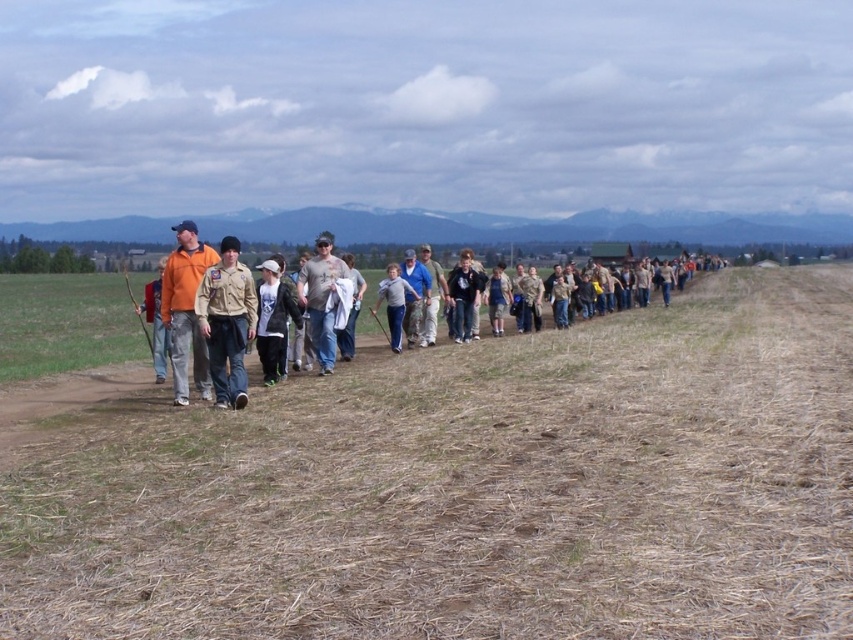
Question: Which is farther from the matte gray t-shirt at center?

Choices:
 (A) white matte shirt at center
 (B) gray cotton shirt at center

Answer: (B)

Question: Estimate the real-world distances between objects in this image. Which object is farther from the white matte shirt at center?

Choices:
 (A) orange cotton shirt at left
 (B) gray cotton shirt at center
 (C) matte gray t-shirt at center
 (D) khaki uniform at center

Answer: (B)

Question: Is brown dry grass at center to the left of white matte shirt at center from the viewer's perspective?

Choices:
 (A) yes
 (B) no

Answer: (B)

Question: Is brown uniform at center thinner than khaki uniform at center?

Choices:
 (A) no
 (B) yes

Answer: (A)

Question: Does orange cotton shirt at left appear over gray cotton shirt at center?

Choices:
 (A) no
 (B) yes

Answer: (B)

Question: Which point appears farthest from the camera in this image?

Choices:
 (A) (x=753, y=572)
 (B) (x=218, y=321)
 (C) (x=393, y=340)
 (D) (x=323, y=268)

Answer: (C)